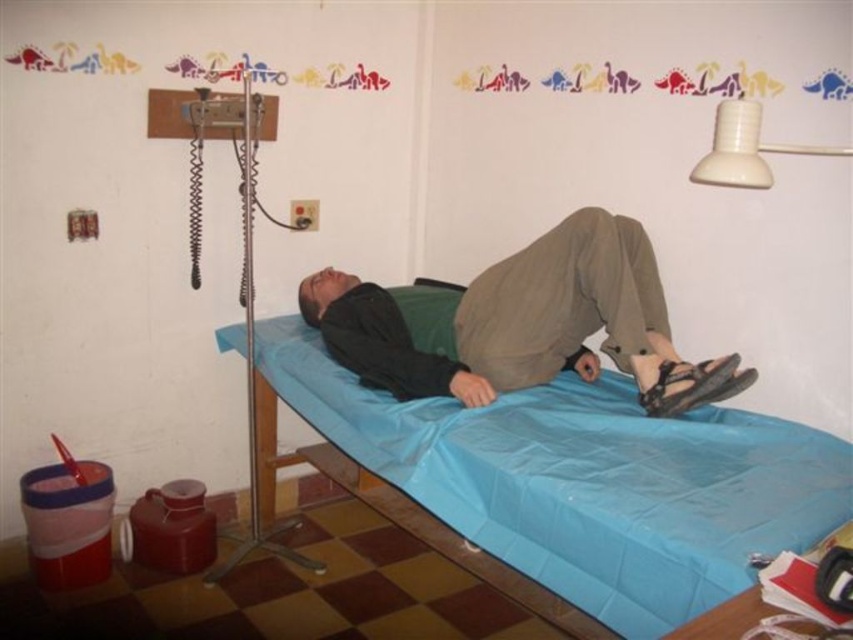
Question: Which point is farther to the camera?

Choices:
 (A) blue fabric mattress at center
 (B) brown matte pants at center
 (C) white plastic lamp at upper right

Answer: (B)

Question: Which point is farther to the camera?

Choices:
 (A) blue fabric mattress at center
 (B) white plastic lamp at upper right
 (C) brown matte pants at center

Answer: (C)

Question: Is blue fabric mattress at center thinner than white plastic lamp at upper right?

Choices:
 (A) yes
 (B) no

Answer: (B)

Question: Does blue fabric mattress at center have a smaller size compared to brown matte pants at center?

Choices:
 (A) no
 (B) yes

Answer: (A)

Question: Is blue fabric mattress at center below white plastic lamp at upper right?

Choices:
 (A) yes
 (B) no

Answer: (A)

Question: Which object is the farthest from the white plastic lamp at upper right?

Choices:
 (A) blue fabric mattress at center
 (B) brown matte pants at center

Answer: (B)